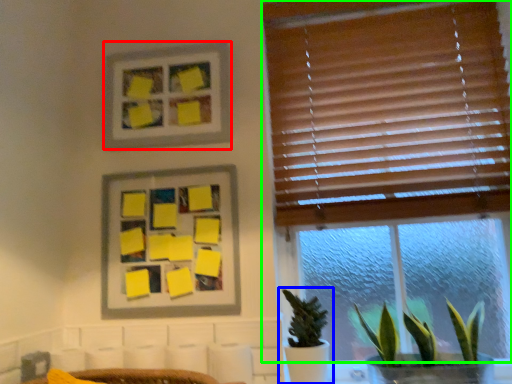
Question: Which object is positioned farthest from picture frame (highlighted by a red box)? Select from houseplant (highlighted by a blue box) and window (highlighted by a green box).

Choices:
 (A) houseplant
 (B) window

Answer: (A)